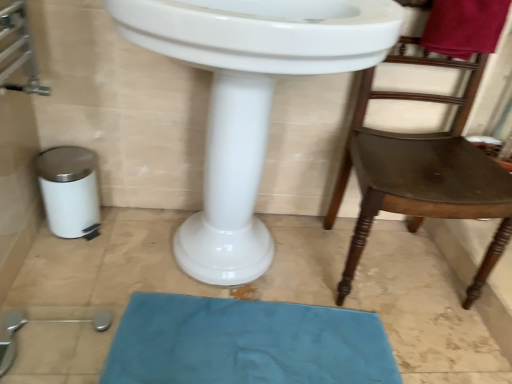
Question: Is blue fabric bath mat at lower center wider or thinner than white glossy sink at center?

Choices:
 (A) wide
 (B) thin

Answer: (B)

Question: From the image's perspective, is blue fabric bath mat at lower center above or below white glossy sink at center?

Choices:
 (A) above
 (B) below

Answer: (B)

Question: Considering the real-world distances, which object is closest to the blue fabric bath mat at lower center?

Choices:
 (A) white glossy sink at center
 (B) brown wooden chair at right

Answer: (A)

Question: Which object is the closest to the blue fabric bath mat at lower center?

Choices:
 (A) brown wooden chair at right
 (B) white glossy sink at center

Answer: (B)